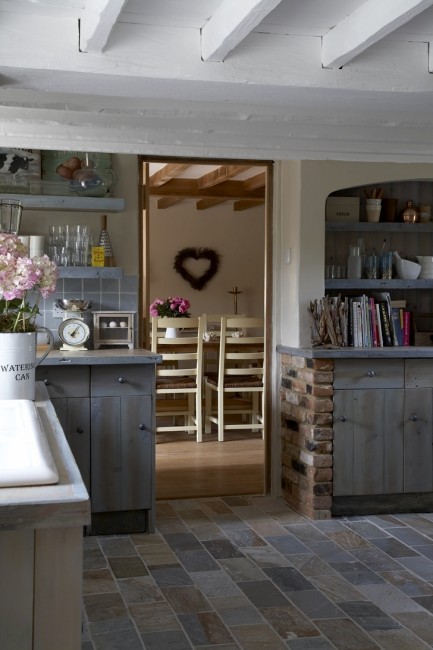
The height and width of the screenshot is (650, 433). I want to click on black book with white writing, so click(385, 331).